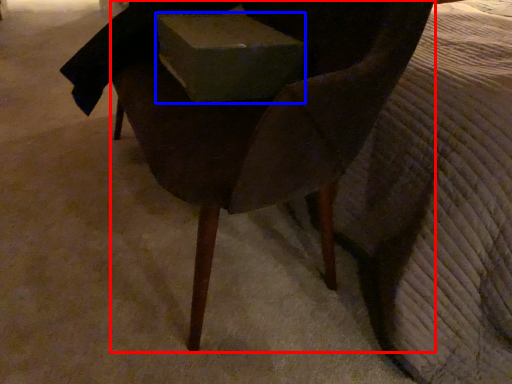
Question: Which object appears farthest to the camera in this image, chair (highlighted by a red box) or box (highlighted by a blue box)?

Choices:
 (A) chair
 (B) box

Answer: (B)